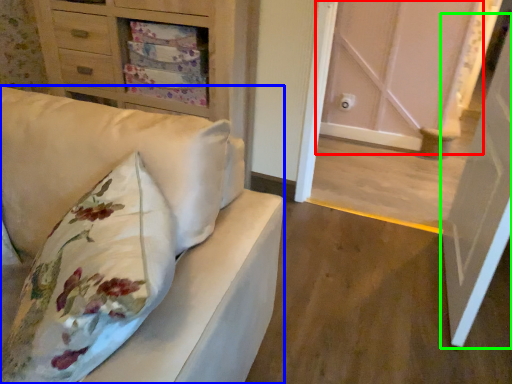
Question: Based on their relative distances, which object is farther from door (highlighted by a red box)? Choose from furniture (highlighted by a blue box) and door (highlighted by a green box).

Choices:
 (A) furniture
 (B) door

Answer: (A)